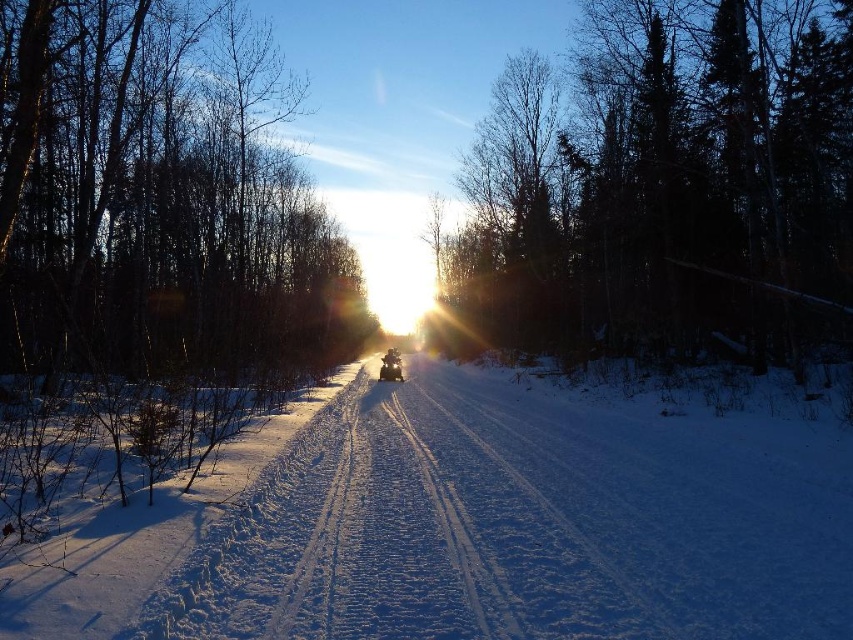
Question: Which point is closer to the camera?

Choices:
 (A) white powdery snow at center
 (B) dark green textured tree at upper center
 (C) smooth bark tree at left
 (D) shiny silver snowmobile at center

Answer: (A)

Question: Is dark green textured tree at upper center bigger than shiny silver snowmobile at center?

Choices:
 (A) no
 (B) yes

Answer: (B)

Question: Which of the following is the farthest from the observer?

Choices:
 (A) (13, 596)
 (B) (550, 307)

Answer: (B)

Question: Is dark green textured tree at upper center thinner than smooth bark tree at left?

Choices:
 (A) no
 (B) yes

Answer: (A)

Question: Which of the following is the farthest from the observer?

Choices:
 (A) (392, 358)
 (B) (167, 348)
 (C) (703, 225)
 (D) (711, 470)

Answer: (A)

Question: Is white powdery snow at center wider than dark green textured tree at upper center?

Choices:
 (A) no
 (B) yes

Answer: (B)